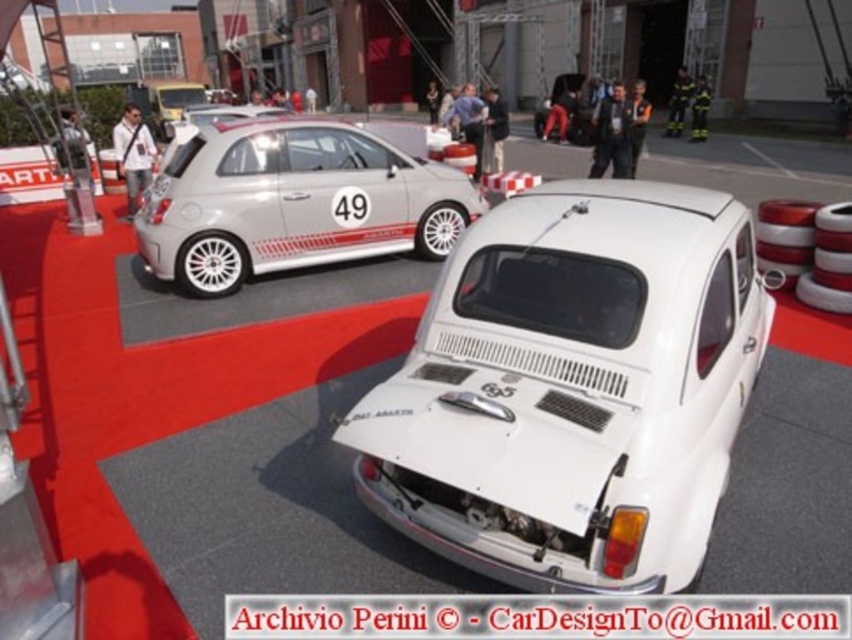
Question: Which object is closer to the camera taking this photo?

Choices:
 (A) white rubber tire at rear
 (B) silver metallic hatchback at upper left

Answer: (B)

Question: Estimate the real-world distances between objects in this image. Which object is closer to the white matte car at center?

Choices:
 (A) silver metallic hatchback at upper left
 (B) white rubber tire at center
 (C) white rubber tire at rear

Answer: (A)

Question: Where is white matte car at center located in relation to silver metallic hatchback at upper left in the image?

Choices:
 (A) below
 (B) above

Answer: (A)

Question: Which of the following is the farthest from the observer?

Choices:
 (A) (519, 298)
 (B) (246, 237)
 (C) (419, 250)
 (D) (229, 262)

Answer: (C)

Question: Is white matte car at center thinner than white rubber tire at center?

Choices:
 (A) no
 (B) yes

Answer: (A)

Question: Does white matte car at center appear over white rubber tire at center?

Choices:
 (A) no
 (B) yes

Answer: (A)